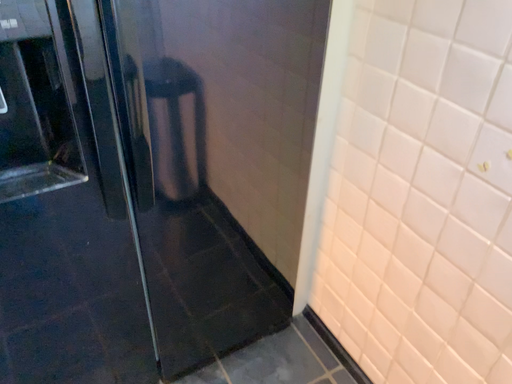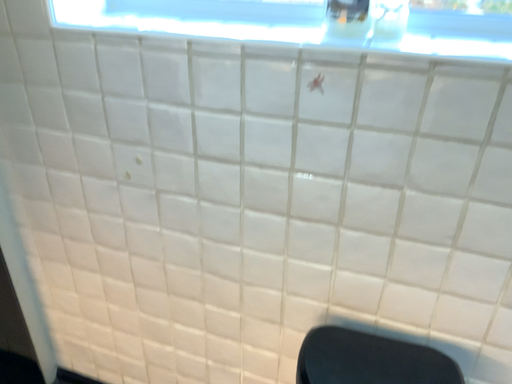
Question: Which way did the camera rotate in the video?

Choices:
 (A) rotated upward
 (B) rotated downward

Answer: (A)